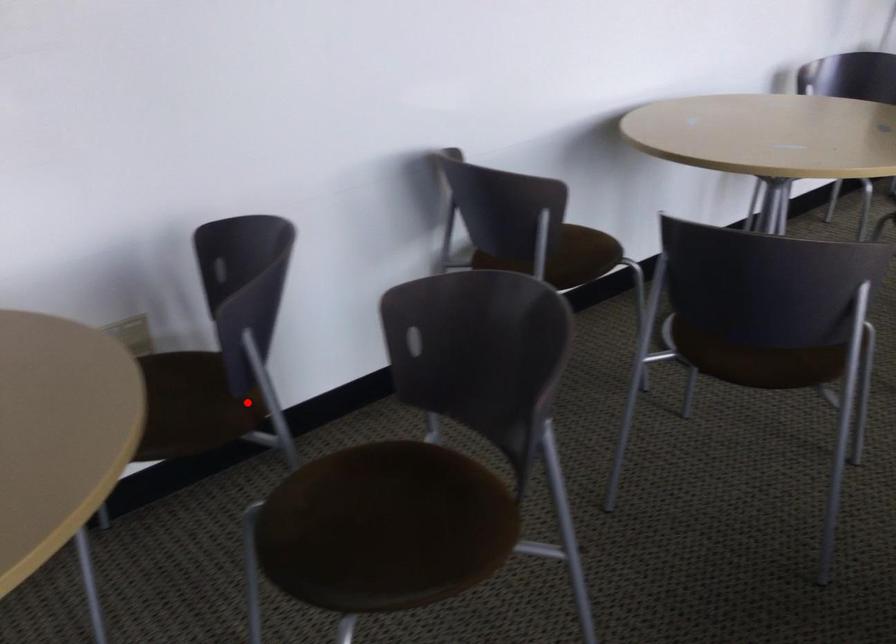
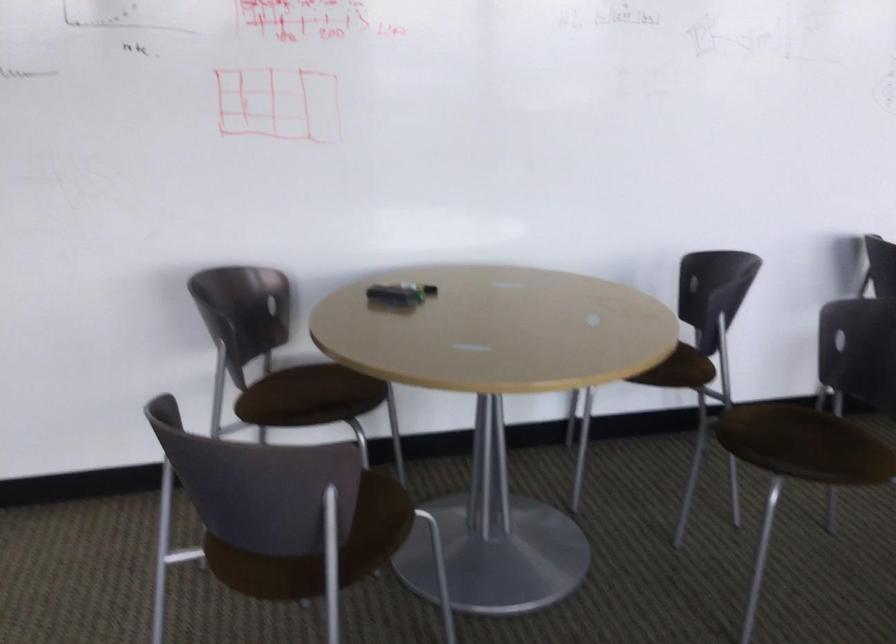
Question: I am providing you with two images of the same scene from different viewpoints. A red point is shown in image1. For the corresponding object point in image2, is it positioned nearer or farther from the camera?

Choices:
 (A) Nearer
 (B) Farther

Answer: (B)